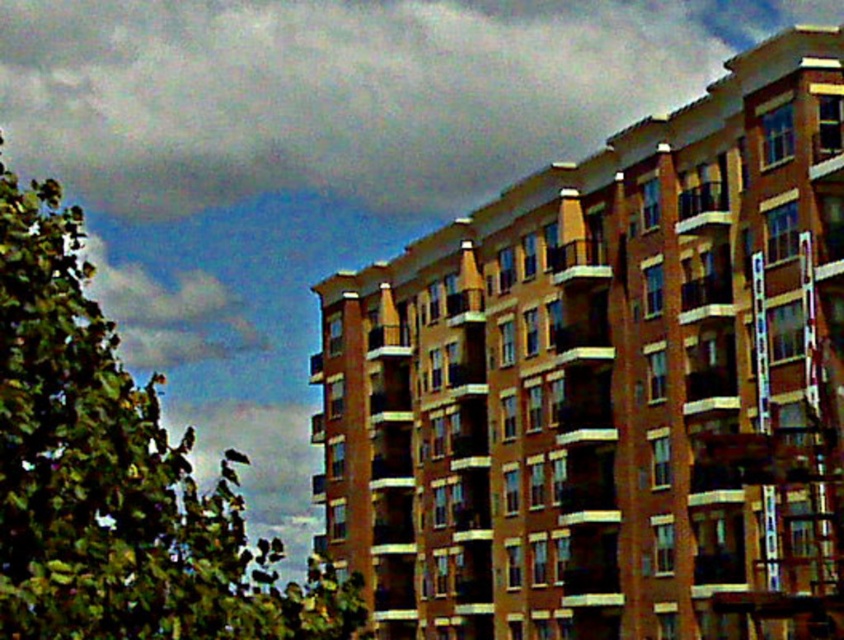
Question: Which point is farther to the camera?

Choices:
 (A) green leafy tree at left
 (B) gray fluffy cloud at upper left

Answer: (B)

Question: Which of the following is the farthest from the observer?

Choices:
 (A) white fluffy cloud at upper left
 (B) gray fluffy cloud at upper left
 (C) green leafy tree at left

Answer: (A)

Question: Is gray fluffy cloud at upper left behind white fluffy cloud at upper left?

Choices:
 (A) no
 (B) yes

Answer: (A)

Question: Estimate the real-world distances between objects in this image. Which object is farther from the gray fluffy cloud at upper left?

Choices:
 (A) white fluffy cloud at upper left
 (B) green leafy tree at left

Answer: (B)

Question: Does green leafy tree at left appear on the left side of white fluffy cloud at upper left?

Choices:
 (A) no
 (B) yes

Answer: (A)

Question: Does gray fluffy cloud at upper left appear over green leafy tree at left?

Choices:
 (A) no
 (B) yes

Answer: (B)